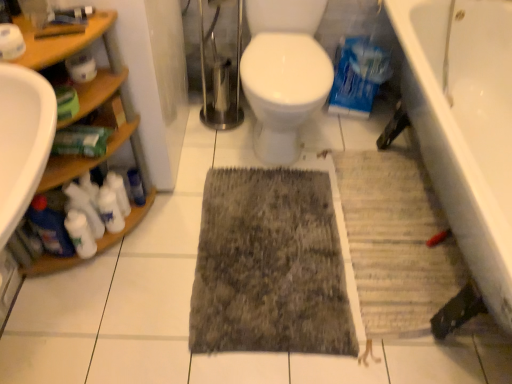
At what (x,y) coordinates should I click in order to perform the action: click on empty space that is to the right of white matte toilet paper at upper left, acting as the second toilet paper starting from the right. Please return your answer as a coordinate pair (x, y). Looking at the image, I should click on (54, 46).